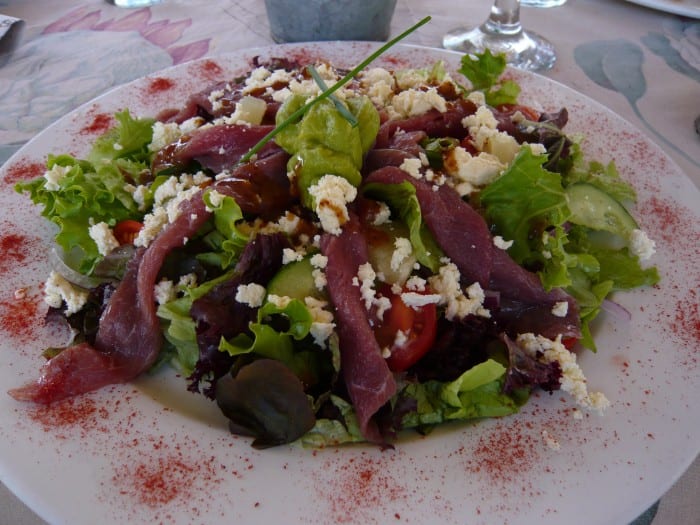
You are a GUI agent. You are given a task and a screenshot of the screen. Output one action in this format:
    pyautogui.click(x=<x>, y=<y>)
    Task: Click on the floor
    The image size is (700, 525).
    Given the screenshot: What is the action you would take?
    pyautogui.click(x=686, y=513)